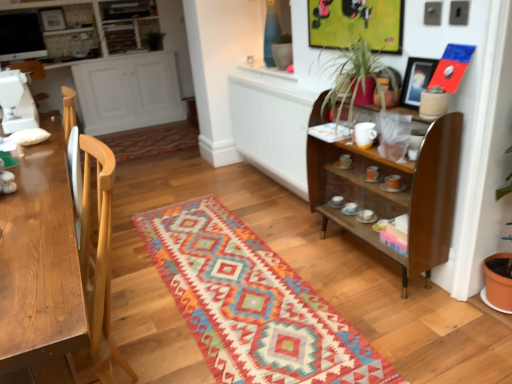
The width and height of the screenshot is (512, 384). Identify the location of vacant space to the left of glossy wood shelf at upper right. (309, 253).